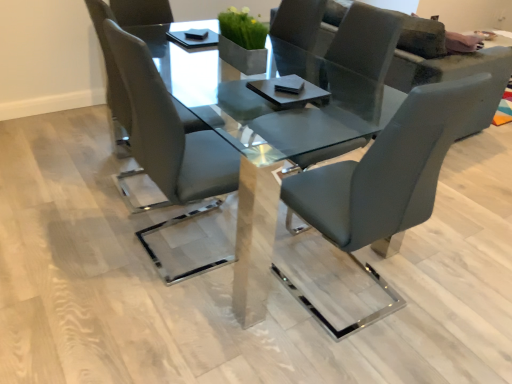
Locate an element on the screen. This screenshot has height=384, width=512. empty space that is in between matte gray chair at center, arranged as the third chair when viewed from the left, and clear glass table at center is located at coordinates (325, 308).